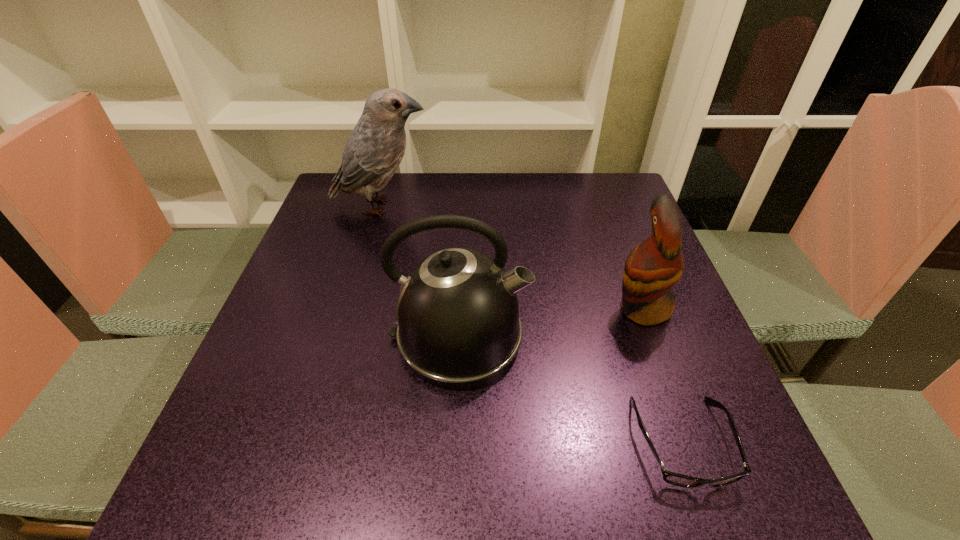
You are a GUI agent. You are given a task and a screenshot of the screen. Output one action in this format:
    pyautogui.click(x=<x>, y=<y>)
    Task: Click on the vacant space positioned on the face of the nearer parrot
    
    Given the screenshot: What is the action you would take?
    pyautogui.click(x=522, y=308)

The width and height of the screenshot is (960, 540). What are the coordinates of `vacant area situated on the face of the nearer parrot` in the screenshot? It's located at (479, 308).

Find the location of a particular element. object positioned at the far edge is located at coordinates (374, 150).

Locate an element on the screen. Image resolution: width=960 pixels, height=540 pixels. object located in the near edge section of the desktop is located at coordinates (672, 478).

Identify the location of object that is at the left edge. (374, 150).

Where is `parrot located at the right edge`? The height and width of the screenshot is (540, 960). parrot located at the right edge is located at coordinates (653, 267).

I want to click on spectacles that is at the right edge, so (672, 478).

Identify the location of object positioned at the far left corner. The image size is (960, 540). (374, 150).

Where is `object present at the near right corner`? The width and height of the screenshot is (960, 540). object present at the near right corner is located at coordinates coord(672,478).

The image size is (960, 540). Find the location of `vacant region at the far edge of the desktop`. vacant region at the far edge of the desktop is located at coordinates (513, 212).